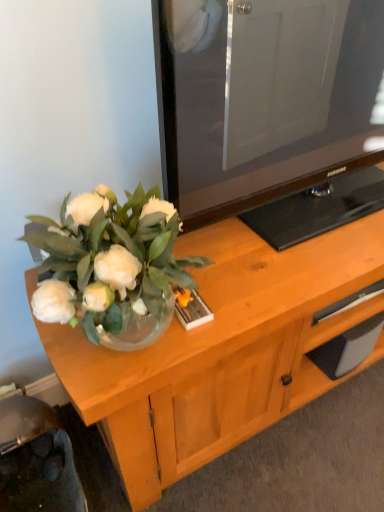
Where is `empty space that is ontop of wooden cabinet at center (from a real-world perspective)`? This screenshot has height=512, width=384. empty space that is ontop of wooden cabinet at center (from a real-world perspective) is located at coordinates (289, 450).